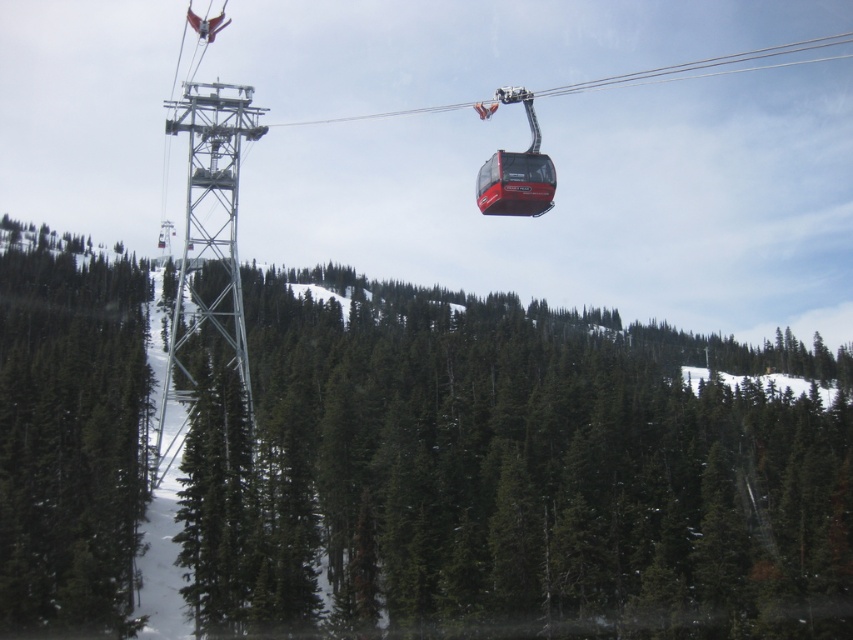
Between green matte tree at center and green matte tree at left, which one has more height?

green matte tree at center

Who is higher up, green matte tree at center or green matte tree at left?

green matte tree at left

Is point (206, 536) positioned behind point (67, 512)?

No.

Find the location of `green matte tree at center`. green matte tree at center is located at coordinates (511, 474).